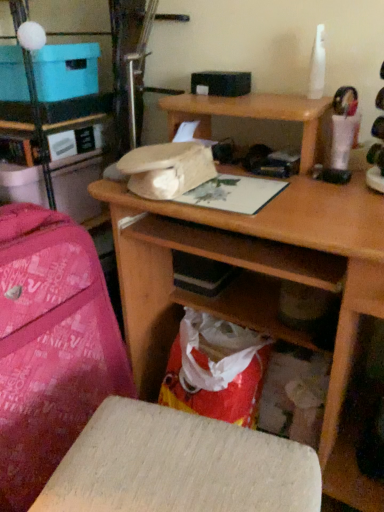
Question: From a real-world perspective, is blue cardboard box at upper left physically above wooden stool at lower center?

Choices:
 (A) yes
 (B) no

Answer: (A)

Question: Is blue cardboard box at upper left positioned before wooden stool at lower center?

Choices:
 (A) no
 (B) yes

Answer: (A)

Question: Is blue cardboard box at upper left smaller than wooden stool at lower center?

Choices:
 (A) yes
 (B) no

Answer: (A)

Question: From the image's perspective, is blue cardboard box at upper left located beneath wooden stool at lower center?

Choices:
 (A) no
 (B) yes

Answer: (A)

Question: Can you confirm if blue cardboard box at upper left is positioned to the left of wooden stool at lower center?

Choices:
 (A) no
 (B) yes

Answer: (B)

Question: From a real-world perspective, is blue cardboard box at upper left physically below wooden stool at lower center?

Choices:
 (A) no
 (B) yes

Answer: (A)

Question: Can you confirm if pink fabric suitcase at left is bigger than blue cardboard box at upper left?

Choices:
 (A) yes
 (B) no

Answer: (A)

Question: Does pink fabric suitcase at left appear on the right side of blue cardboard box at upper left?

Choices:
 (A) yes
 (B) no

Answer: (A)

Question: Would you consider pink fabric suitcase at left to be distant from blue cardboard box at upper left?

Choices:
 (A) yes
 (B) no

Answer: (B)

Question: From the image's perspective, is pink fabric suitcase at left located above blue cardboard box at upper left?

Choices:
 (A) no
 (B) yes

Answer: (A)

Question: From a real-world perspective, does pink fabric suitcase at left stand above blue cardboard box at upper left?

Choices:
 (A) yes
 (B) no

Answer: (B)

Question: Is pink fabric suitcase at left facing away from blue cardboard box at upper left?

Choices:
 (A) yes
 (B) no

Answer: (B)

Question: Is pink fabric bag at left further to camera compared to wooden desk at center?

Choices:
 (A) no
 (B) yes

Answer: (B)